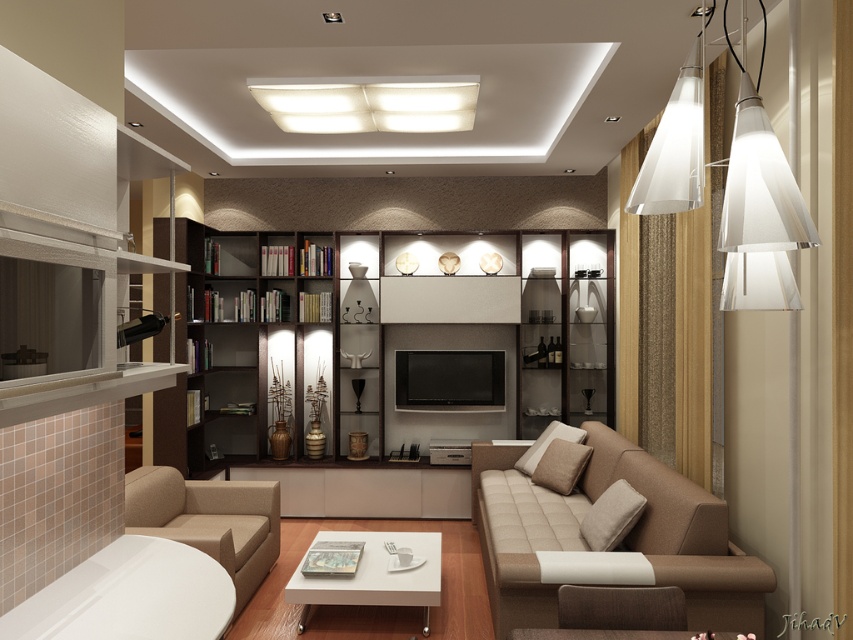
Question: Is the position of beige fabric couch at lower right less distant than that of white translucent pendant lights at upper right?

Choices:
 (A) yes
 (B) no

Answer: (B)

Question: Estimate the real-world distances between objects in this image. Which object is farther from the beige fabric armchair at lower left?

Choices:
 (A) white glossy coffee table at center
 (B) beige fabric couch at lower right

Answer: (B)

Question: Estimate the real-world distances between objects in this image. Which object is farther from the brown wood bookshelf at center?

Choices:
 (A) beige fabric couch at lower right
 (B) white glossy coffee table at center
 (C) white translucent pendant lights at upper right

Answer: (C)

Question: Is beige fabric armchair at lower left in front of white glossy coffee table at center?

Choices:
 (A) no
 (B) yes

Answer: (B)

Question: Can you confirm if brown wood bookshelf at center is positioned above beige fabric armchair at lower left?

Choices:
 (A) no
 (B) yes

Answer: (B)

Question: Which point is closer to the camera taking this photo?

Choices:
 (A) (426, 630)
 (B) (679, 88)
 (C) (381, 90)

Answer: (B)